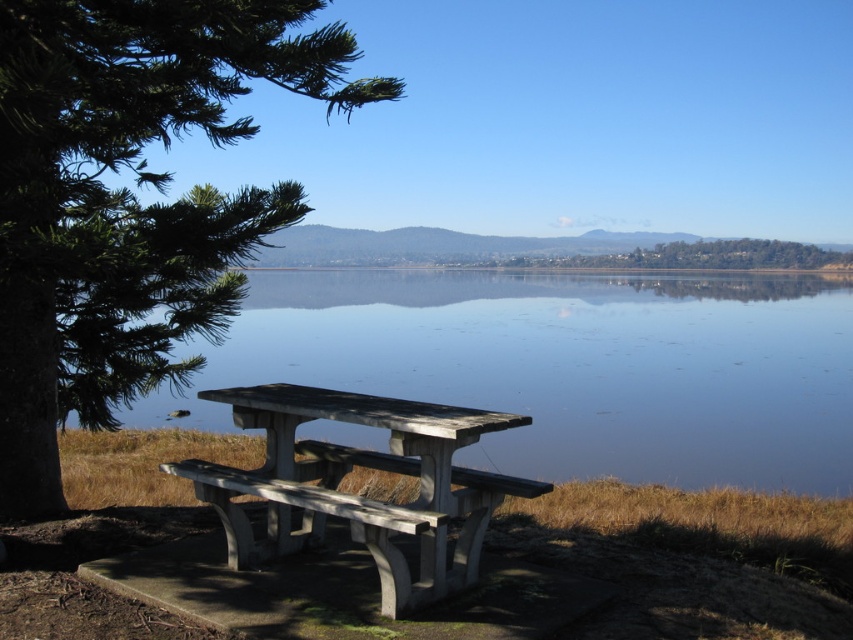
You are planning to set up a small tent near the smooth blue water at center and the green textured tree at left. Which location would provide more space for the tent?

The smooth blue water at center is larger in size than the green textured tree at left, so setting up the tent near the smooth blue water at center would provide more space.